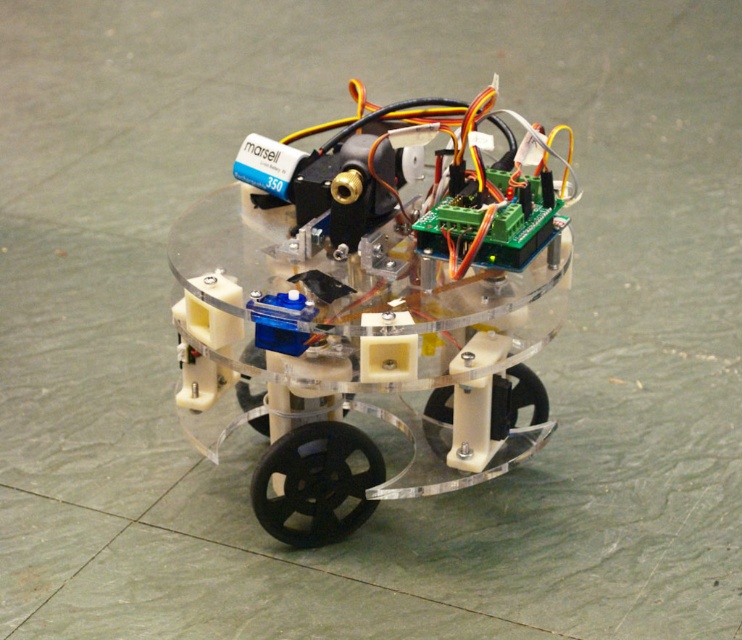
Question: Is clear acrylic robot at center thinner than black rubber wheel at center?

Choices:
 (A) no
 (B) yes

Answer: (A)

Question: Which of the following is the farthest from the observer?

Choices:
 (A) black rubber wheel at center
 (B) black plastic wheel at lower center

Answer: (B)

Question: Which object is positioned farthest from the black plastic wheel at lower center?

Choices:
 (A) clear acrylic robot at center
 (B) black rubber wheel at center

Answer: (A)

Question: Which of the following is the closest to the observer?

Choices:
 (A) (390, 368)
 (B) (326, 474)
 (C) (536, 404)

Answer: (A)

Question: Is clear acrylic robot at center above black plastic wheel at lower center?

Choices:
 (A) no
 (B) yes

Answer: (B)

Question: Is clear acrylic robot at center further to the viewer compared to black plastic wheel at lower center?

Choices:
 (A) no
 (B) yes

Answer: (A)